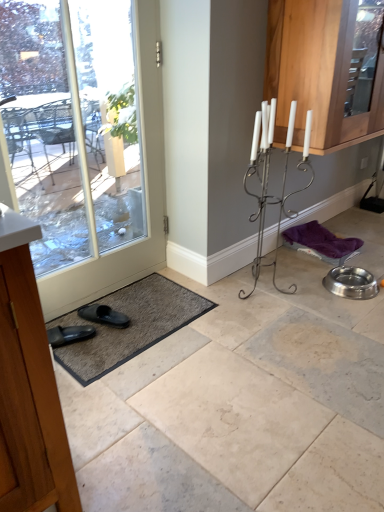
Locate an element on the screen. vacant area on the back side of metallic silver candle holder at center right is located at coordinates (269, 268).